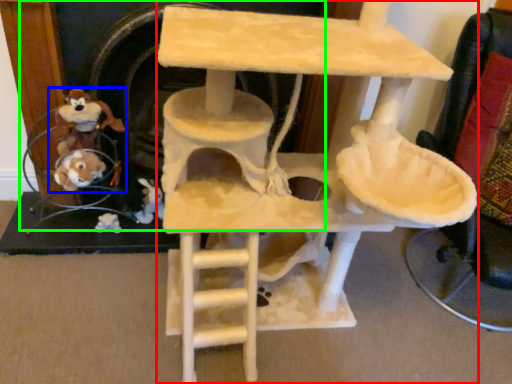
Question: Considering the real-world distances, which object is closest to furniture (highlighted by a red box)? toy (highlighted by a blue box) or fireplace (highlighted by a green box).

Choices:
 (A) toy
 (B) fireplace

Answer: (B)